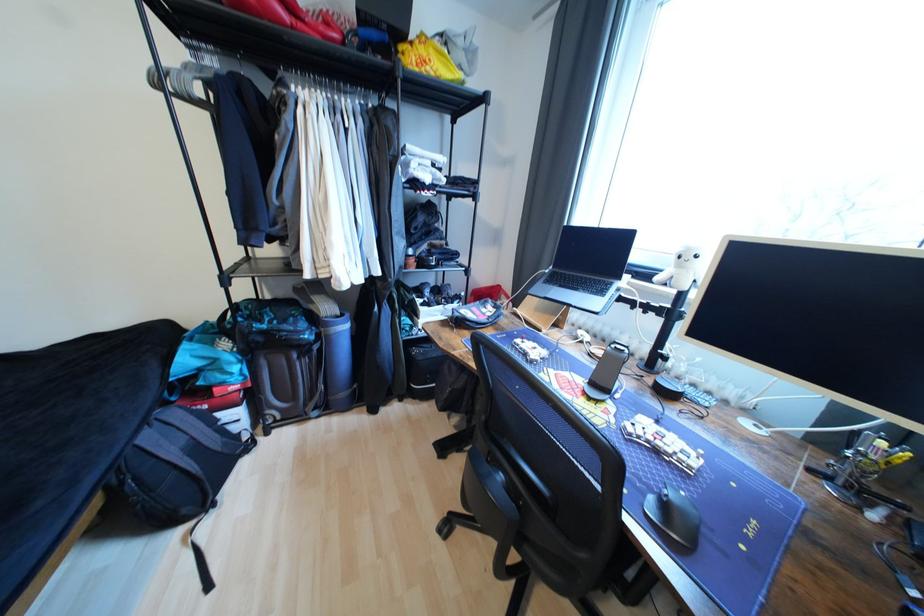
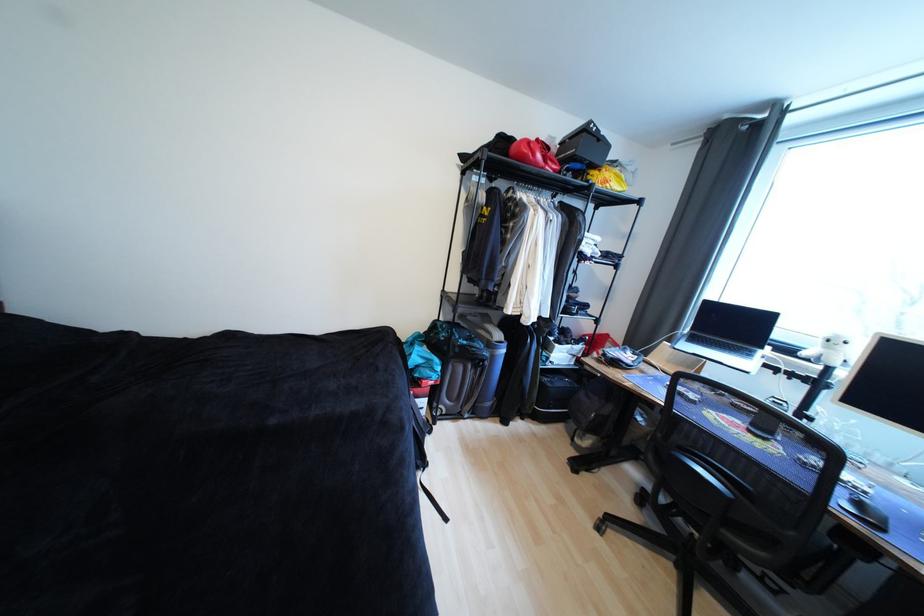
In the second image, find the point that corresponds to point 270,334 in the first image.

(469, 347)